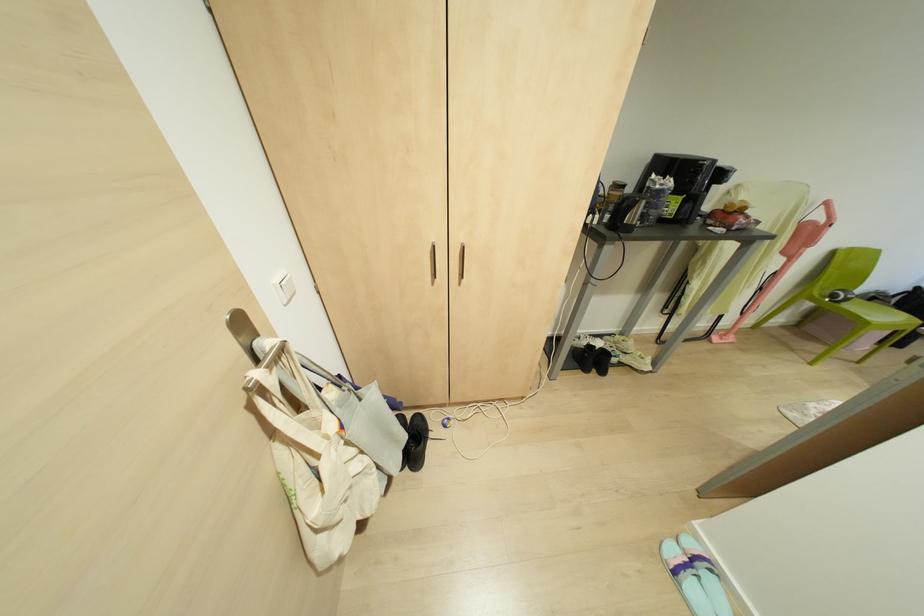
Identify the location of white light switch. (285, 288).